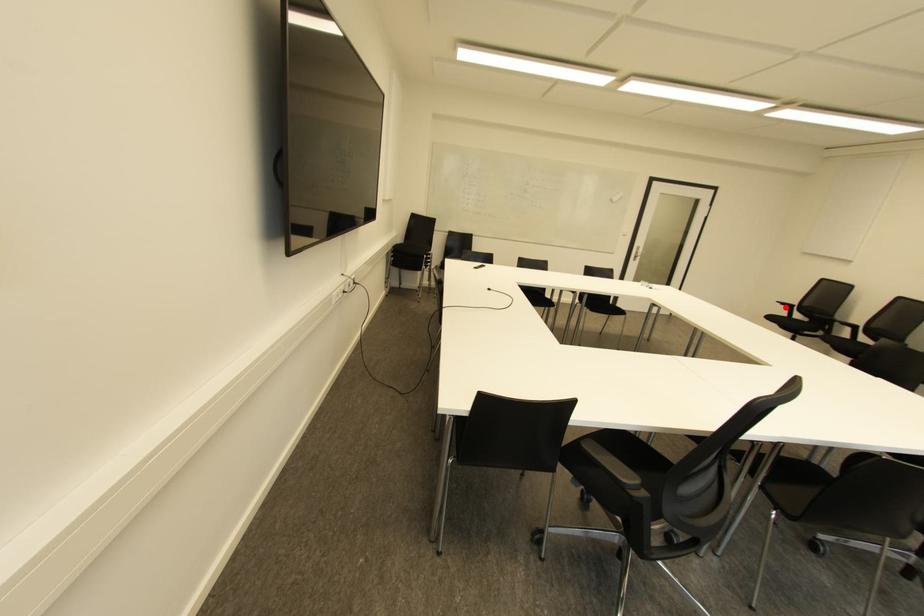
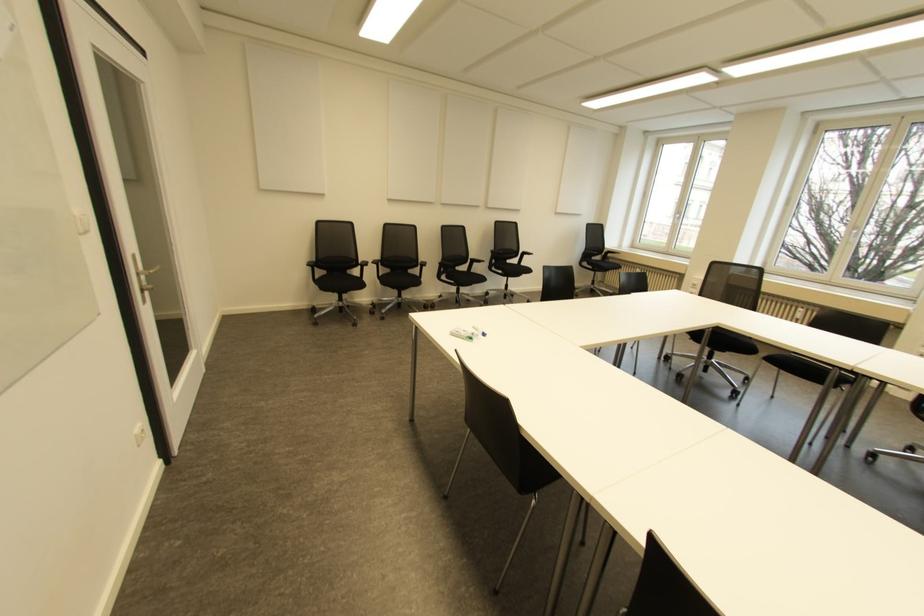
In the second image, find the point that corresponds to the highlighted location in the first image.

(310, 268)